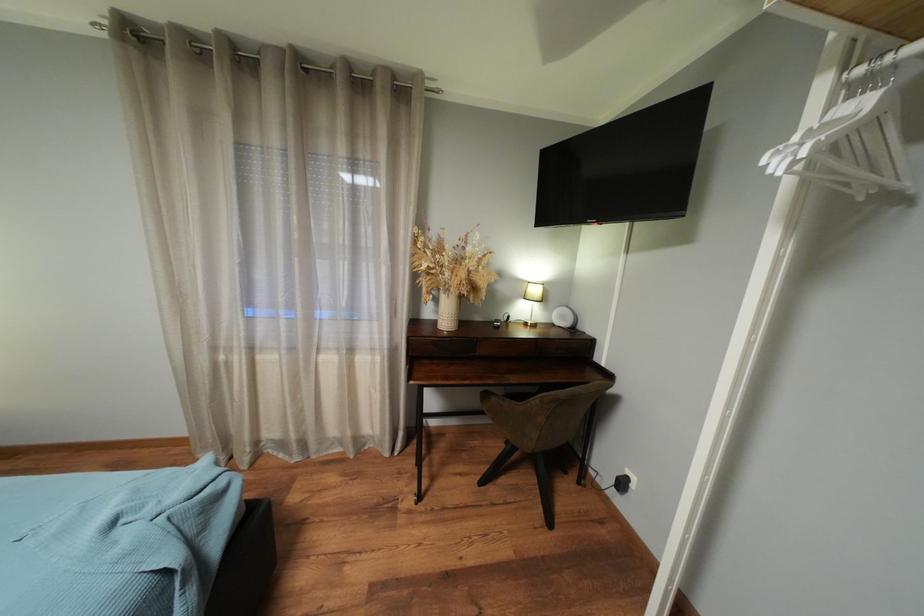
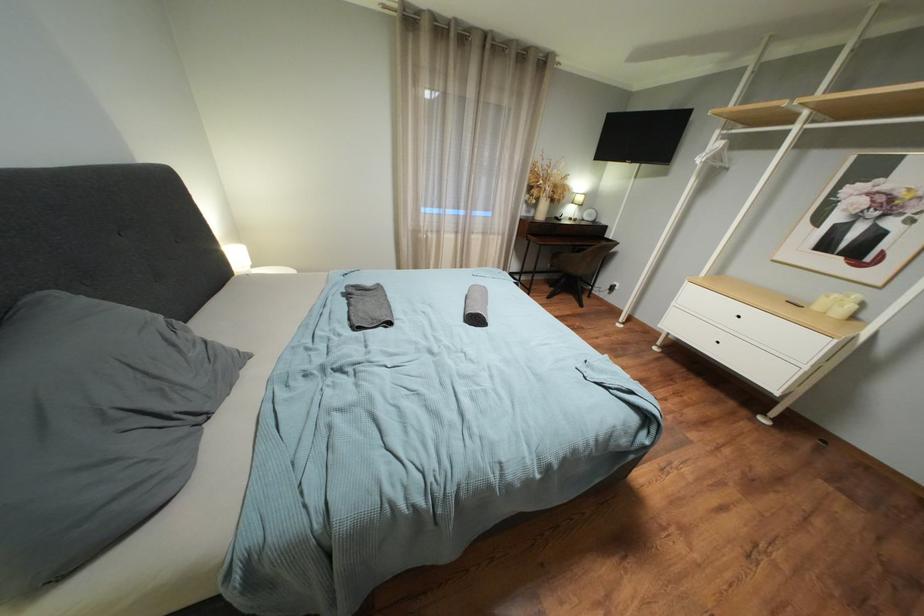
What movement of the cameraman would produce the second image?

The cameraman moved toward left, backward.